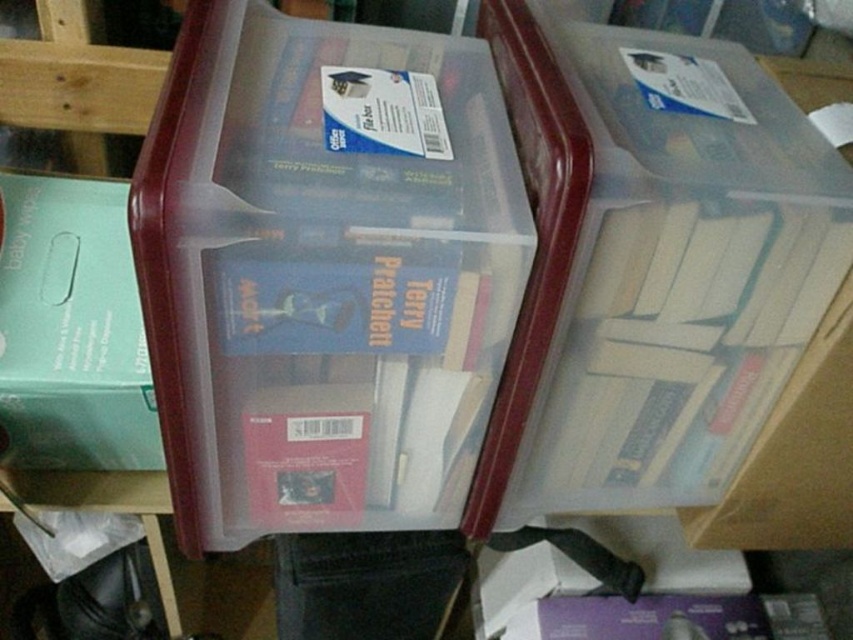
Between clear plastic box at upper right and teal matte baby wipes at left, which one is positioned higher?

clear plastic box at upper right

Who is more forward, (695,486) or (140,342)?

Point (140,342) is in front.

The height and width of the screenshot is (640, 853). What do you see at coordinates (693, 298) in the screenshot?
I see `clear plastic box at upper right` at bounding box center [693, 298].

Find the location of a particular element. Image resolution: width=853 pixels, height=640 pixels. clear plastic box at upper right is located at coordinates (693, 298).

Between transparent plastic box at center and teal matte baby wipes at left, which one appears on the right side from the viewer's perspective?

transparent plastic box at center is more to the right.

Where is `transparent plastic box at center`? The height and width of the screenshot is (640, 853). transparent plastic box at center is located at coordinates (322, 276).

Who is positioned more to the right, transparent plastic box at center or clear plastic box at upper right?

clear plastic box at upper right

Measure the distance from transparent plastic box at center to clear plastic box at upper right.

A distance of 6.40 inches exists between transparent plastic box at center and clear plastic box at upper right.

Between point (329, 465) and point (508, 8), which one is positioned in front?

Point (329, 465)

This screenshot has height=640, width=853. In order to click on transparent plastic box at center in this screenshot , I will do `click(322, 276)`.